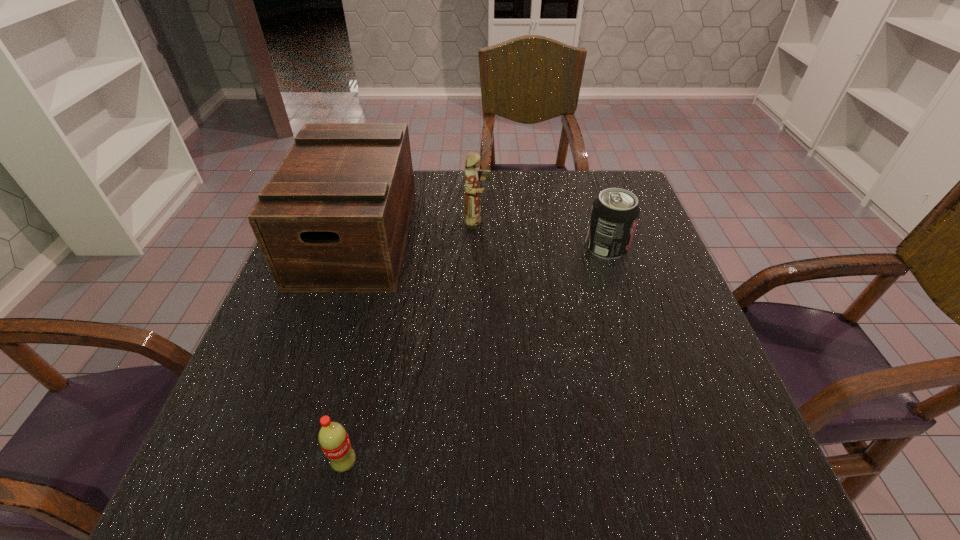
I want to click on box, so click(x=334, y=218).

Find the location of a particular element. The width and height of the screenshot is (960, 540). the third object from left to right is located at coordinates (473, 219).

Identify the location of the farther soda. The height and width of the screenshot is (540, 960). [614, 215].

Find the location of `the rightmost object`. the rightmost object is located at coordinates coord(614,215).

Locate an element on the screen. This screenshot has width=960, height=540. the nearer soda is located at coordinates (333, 439).

Locate an element on the screen. the left soda is located at coordinates (333, 439).

The image size is (960, 540). I want to click on free spot located on the front of the box, so click(286, 453).

I want to click on vacant space located on the front-facing side of the third object from left to right, so click(x=640, y=222).

Image resolution: width=960 pixels, height=540 pixels. I want to click on free space located 0.350m on the left of the farther soda, so click(445, 247).

Where is `free region located on the back of the nearer soda`? This screenshot has height=540, width=960. free region located on the back of the nearer soda is located at coordinates (378, 311).